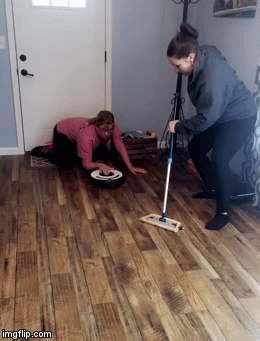
You are a GUI agent. You are given a task and a screenshot of the screen. Output one action in this format:
    pyautogui.click(x=<x>, y=<y>)
    Task: Click on the mop pole
    The width and height of the screenshot is (260, 341).
    Given the screenshot: What is the action you would take?
    pyautogui.click(x=180, y=142)